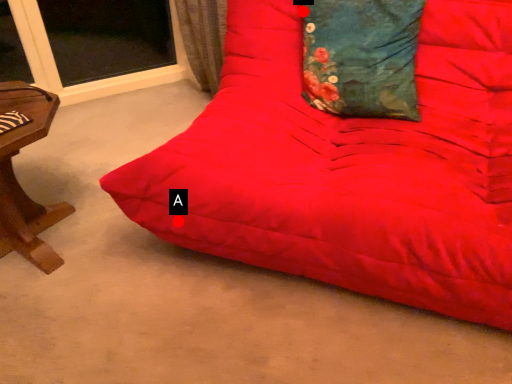
Question: Two points are circled on the image, labeled by A and B beside each circle. Which point is farther from the camera taking this photo?

Choices:
 (A) A is further
 (B) B is further

Answer: (B)